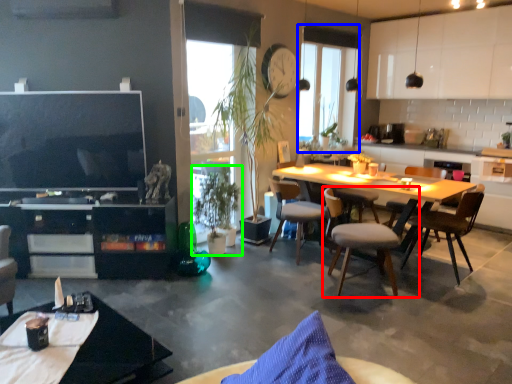
Question: Considering the real-world distances, which object is farthest from chair (highlighted by a red box)? window screen (highlighted by a blue box) or houseplant (highlighted by a green box)?

Choices:
 (A) window screen
 (B) houseplant

Answer: (A)